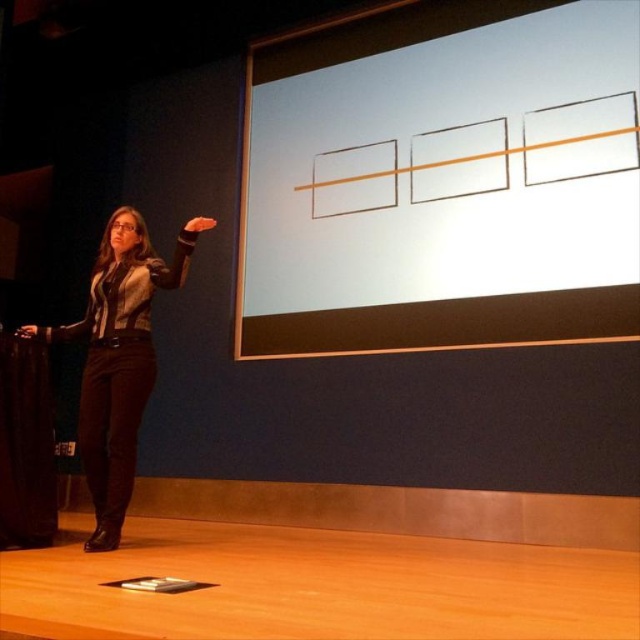
Who is lower down, white matte projection screen at upper center or black leather pants at lower left?

black leather pants at lower left is below.

Is white matte projection screen at upper center to the right of black leather pants at lower left from the viewer's perspective?

Yes, white matte projection screen at upper center is to the right of black leather pants at lower left.

Locate an element on the screen. The width and height of the screenshot is (640, 640). white matte projection screen at upper center is located at coordinates (442, 179).